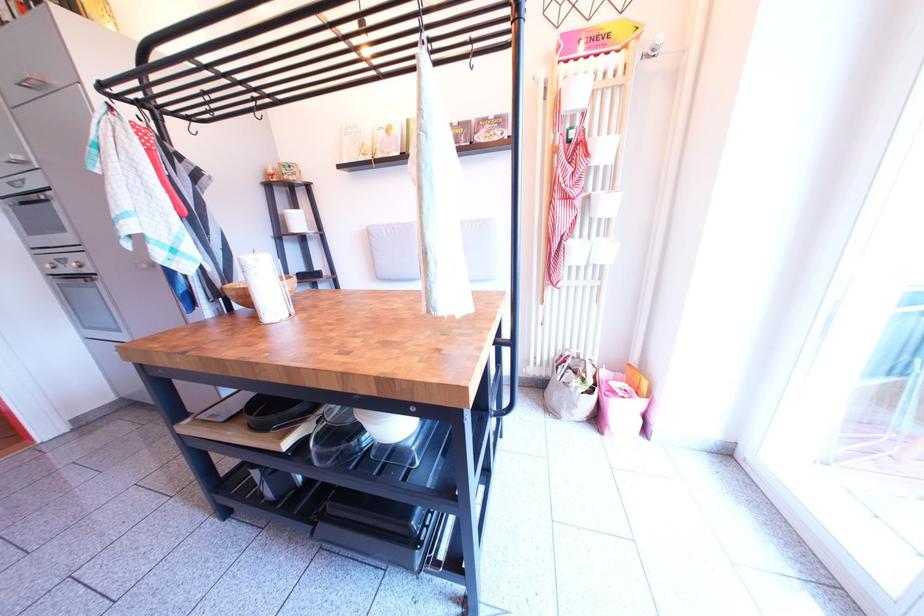
Locate an element on the screen. The width and height of the screenshot is (924, 616). pink gift bag is located at coordinates (x=622, y=402).